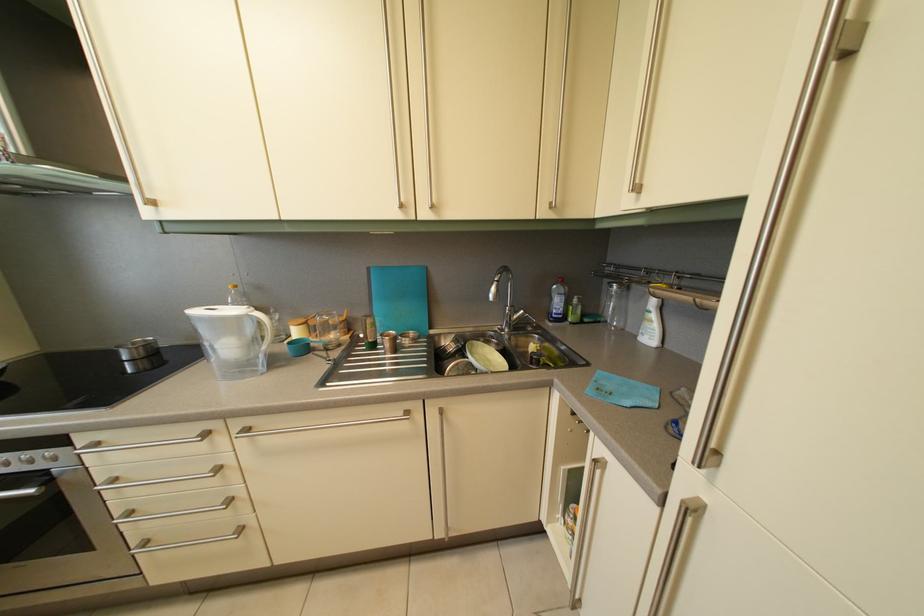
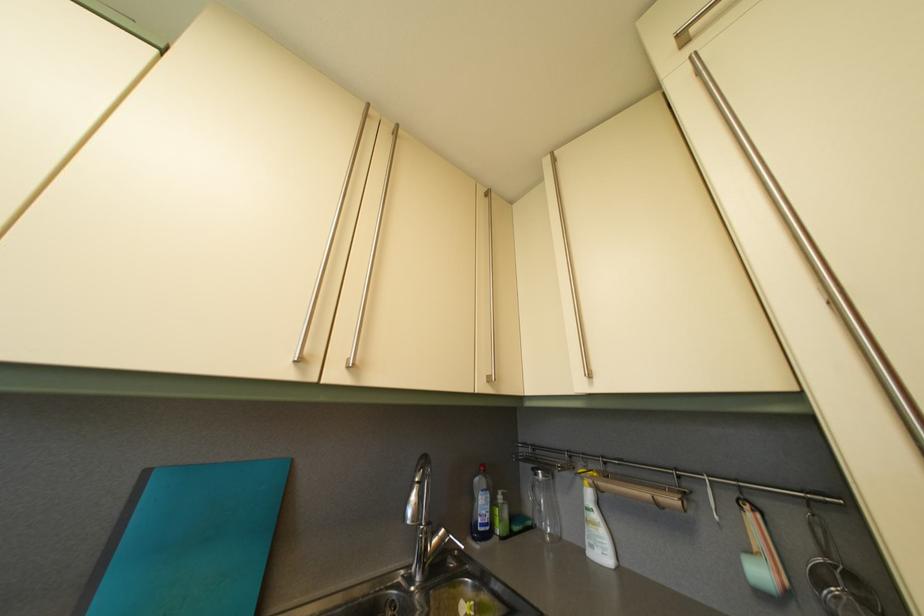
In the second image, find the point that corresponds to [377,276] in the first image.

(154, 480)